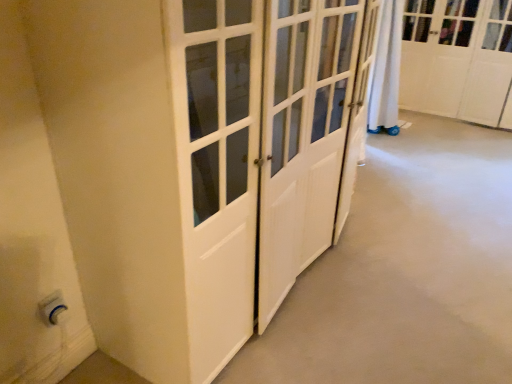
Question: Is white glossy cabinet at upper right situated inside white plastic electric outlet at lower left or outside?

Choices:
 (A) outside
 (B) inside

Answer: (A)

Question: From a real-world perspective, relative to white plastic electric outlet at lower left, is white glossy cabinet at upper right vertically above or below?

Choices:
 (A) above
 (B) below

Answer: (A)

Question: Based on their sizes in the image, would you say white glossy cabinet at upper right is bigger or smaller than white plastic electric outlet at lower left?

Choices:
 (A) big
 (B) small

Answer: (A)

Question: Looking at their shapes, would you say white plastic electric outlet at lower left is wider or thinner than white glossy cabinet at upper right?

Choices:
 (A) thin
 (B) wide

Answer: (A)

Question: In terms of height, does white plastic electric outlet at lower left look taller or shorter compared to white glossy cabinet at upper right?

Choices:
 (A) short
 (B) tall

Answer: (A)

Question: Is point 62,306 closer or farther from the camera than point 417,109?

Choices:
 (A) closer
 (B) farther

Answer: (A)

Question: Is white plastic electric outlet at lower left in front of or behind white glossy cabinet at upper right in the image?

Choices:
 (A) front
 (B) behind

Answer: (A)